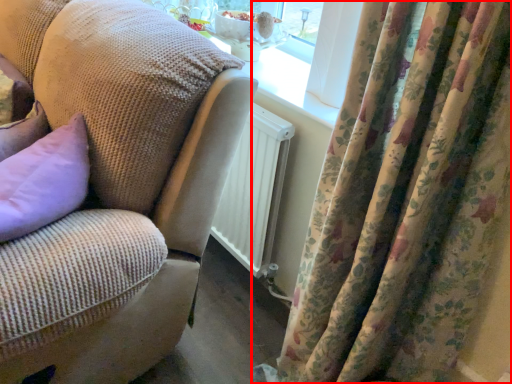
Question: From the image's perspective, where is curtain (annotated by the red box) located in relation to studio couch in the image?

Choices:
 (A) below
 (B) above

Answer: (A)